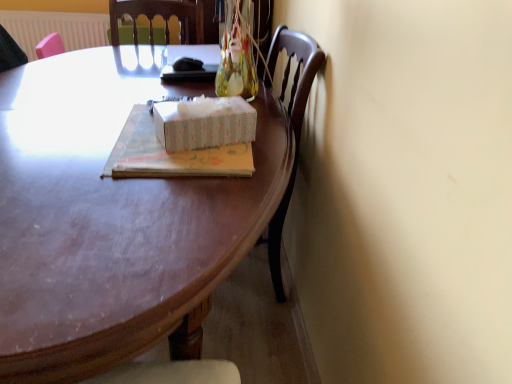
Question: Considering the relative sizes of shiny brown desk at center and white textured radiator at upper left in the image provided, is shiny brown desk at center taller than white textured radiator at upper left?

Choices:
 (A) yes
 (B) no

Answer: (A)

Question: Does shiny brown desk at center appear on the left side of white textured radiator at upper left?

Choices:
 (A) no
 (B) yes

Answer: (A)

Question: Is shiny brown desk at center wider than white textured radiator at upper left?

Choices:
 (A) yes
 (B) no

Answer: (A)

Question: Is shiny brown desk at center at the right side of white textured radiator at upper left?

Choices:
 (A) yes
 (B) no

Answer: (A)

Question: Could white textured radiator at upper left be considered to be inside shiny brown desk at center?

Choices:
 (A) no
 (B) yes

Answer: (A)

Question: Is the depth of shiny brown desk at center greater than that of white textured radiator at upper left?

Choices:
 (A) no
 (B) yes

Answer: (A)

Question: Can you confirm if shiny brown desk at center is smaller than white paper tissue box at center?

Choices:
 (A) no
 (B) yes

Answer: (A)

Question: Can you see shiny brown desk at center touching white paper tissue box at center?

Choices:
 (A) yes
 (B) no

Answer: (B)

Question: Is shiny brown desk at center further to the viewer compared to white paper tissue box at center?

Choices:
 (A) no
 (B) yes

Answer: (A)

Question: Is shiny brown desk at center not close to white paper tissue box at center?

Choices:
 (A) yes
 (B) no

Answer: (B)

Question: Is shiny brown desk at center completely or partially outside of white paper tissue box at center?

Choices:
 (A) no
 (B) yes

Answer: (B)

Question: Does shiny brown desk at center appear on the left side of white paper tissue box at center?

Choices:
 (A) no
 (B) yes

Answer: (B)

Question: From the image's perspective, is matte paper book at center beneath shiny brown desk at center?

Choices:
 (A) yes
 (B) no

Answer: (B)